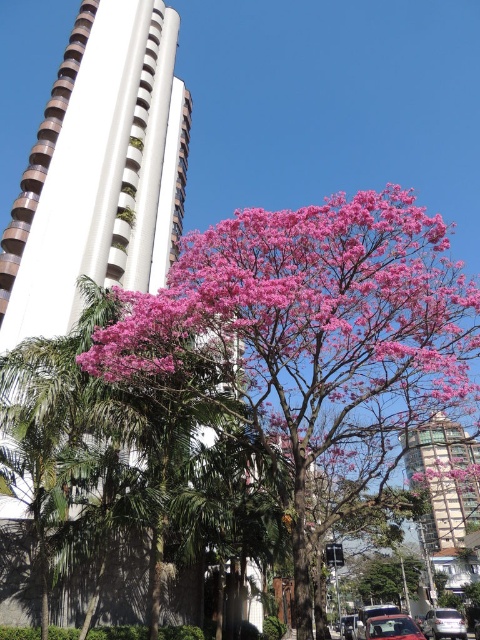
Does metallic glass building at right have a smaller size compared to shiny red car at center?

No, metallic glass building at right is not smaller than shiny red car at center.

Which is below, metallic glass building at right or shiny red car at center?

metallic glass building at right is lower down.

Which is behind, point (425, 422) or point (420, 637)?

The point (425, 422) is more distant.

Locate an element on the screen. The image size is (480, 640). metallic glass building at right is located at coordinates (444, 477).

Between point (354, 339) and point (444, 456), which one is positioned in front?

Point (354, 339) is more forward.

Does pink fluffy tree at center lie in front of metallic glass building at right?

Yes.

Who is more forward, (434, 257) or (467, 483)?

Point (434, 257) is more forward.

At what (x,y) coordinates should I click in order to perform the action: click on pink fluffy tree at center. Please return your answer as a coordinate pair (x, y). Looking at the image, I should click on (310, 316).

Which is in front, point (307, 376) or point (455, 625)?

Positioned in front is point (307, 376).

Is point (228, 317) closer to viewer compared to point (424, 634)?

Yes, it is in front of point (424, 634).

At what (x,y) coordinates should I click in order to perform the action: click on pink fluffy tree at center. Please return your answer as a coordinate pair (x, y). This screenshot has height=640, width=480. Looking at the image, I should click on (310, 316).